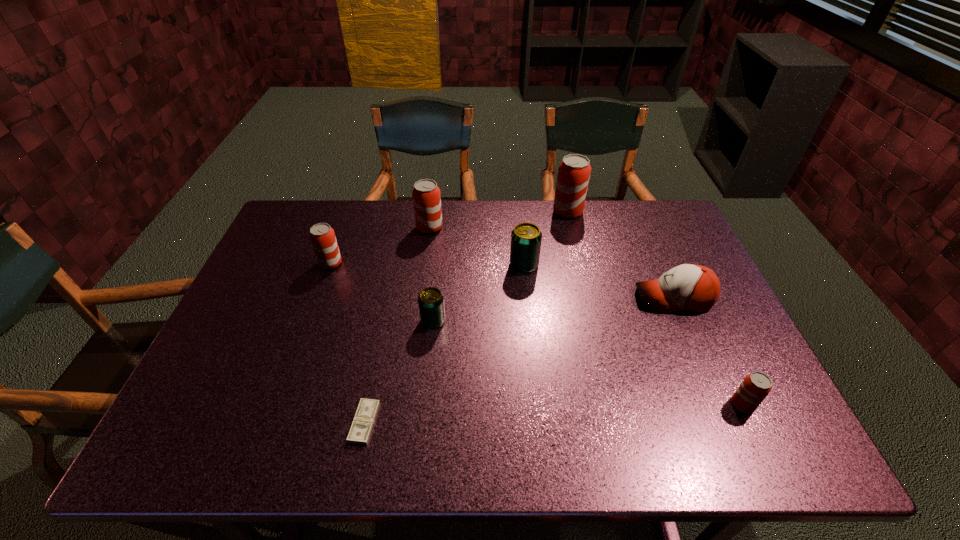
Where is `vacant space located on the front-facing side of the baseball cap`? This screenshot has height=540, width=960. vacant space located on the front-facing side of the baseball cap is located at coordinates (532, 298).

You are a GUI agent. You are given a task and a screenshot of the screen. Output one action in this format:
    pyautogui.click(x=<x>, y=<y>)
    Task: Click on the vacant region located 0.120m on the front-facing side of the baseball cap
    
    Given the screenshot: What is the action you would take?
    pyautogui.click(x=592, y=298)

You are a GUI agent. You are given a task and a screenshot of the screen. Output one action in this format:
    pyautogui.click(x=<x>, y=<y>)
    Task: Click on the free location located on the left of the nearer green beer can
    Image resolution: width=960 pixels, height=540 pixels.
    Given the screenshot: What is the action you would take?
    pyautogui.click(x=294, y=321)

Where is `vacant region located 0.090m on the back of the nearest beer can`? vacant region located 0.090m on the back of the nearest beer can is located at coordinates (722, 362).

Where is `free location located 0.350m on the back of the seventh object from right to left`? The image size is (960, 540). free location located 0.350m on the back of the seventh object from right to left is located at coordinates pos(391,291).

You are a GUI agent. You are given a task and a screenshot of the screen. Output one action in this format:
    pyautogui.click(x=<x>, y=<y>)
    Task: Click on the object situated at the near edge
    
    Given the screenshot: What is the action you would take?
    pyautogui.click(x=361, y=428)

Locate an element on the screen. The width and height of the screenshot is (960, 540). baseball cap at the right edge is located at coordinates (690, 287).

Where is `beer can that is at the right edge`? beer can that is at the right edge is located at coordinates (755, 387).

Image resolution: width=960 pixels, height=540 pixels. Identify the location of blank space at the far edge of the desktop. (560, 235).

Identify the location of free space at the near edge of the desktop. The height and width of the screenshot is (540, 960). [513, 453].